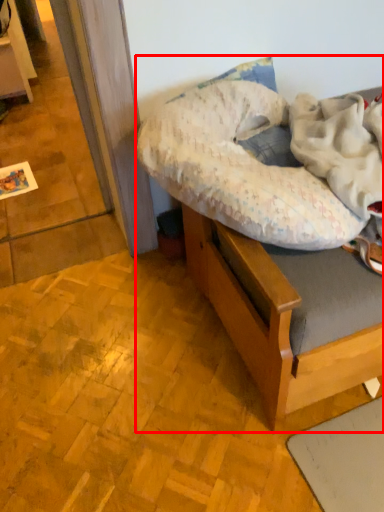
Question: From the image's perspective, considering the relative positions of hospital bed (annotated by the red box) and pillow in the image provided, where is hospital bed (annotated by the red box) located with respect to the staircase?

Choices:
 (A) above
 (B) below

Answer: (B)